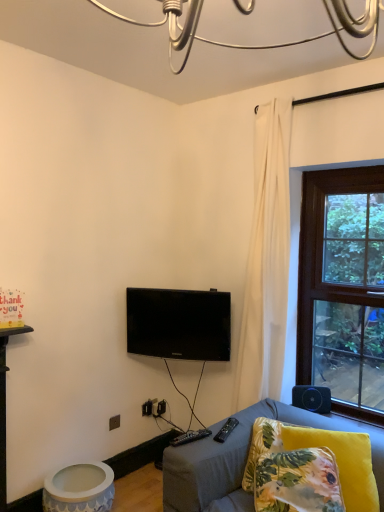
What do you see at coordinates (312, 398) in the screenshot? I see `black fabric speaker at lower right` at bounding box center [312, 398].

Measure the distance between yellow floral pillow at lower right, the first pillow when ordered from left to right, and camera.

yellow floral pillow at lower right, the first pillow when ordered from left to right, and camera are 5.64 feet apart from each other.

Locate an element on the screen. black plastic remote at lower center, the second remote in the left-to-right sequence is located at coordinates (226, 430).

What do you see at coordinates (190, 437) in the screenshot? I see `black plastic remote at lower center, the second remote from the right` at bounding box center [190, 437].

This screenshot has height=512, width=384. What do you see at coordinates (243, 460) in the screenshot? I see `velvet gray couch at lower right` at bounding box center [243, 460].

Identify the location of matte white ceramic table at lower left. The width and height of the screenshot is (384, 512). (79, 488).

Does point (288, 428) appear closer or farther from the camera than point (317, 456)?

Point (288, 428) appears to be farther away from the viewer than point (317, 456).

Could you tell me if yellow floral fabric pillow at lower right, marked as the 2th pillow in a left-to-right arrangement, is facing yellow floral pillow at lower right, the first pillow when ordered from left to right?

Yes, yellow floral fabric pillow at lower right, marked as the 2th pillow in a left-to-right arrangement, is facing yellow floral pillow at lower right, the first pillow when ordered from left to right.

Is yellow floral fabric pillow at lower right, marked as the 2th pillow in a left-to-right arrangement, placed right next to yellow floral pillow at lower right, which appears as the 2th pillow when viewed from the right?

No, yellow floral fabric pillow at lower right, marked as the 2th pillow in a left-to-right arrangement, is not making contact with yellow floral pillow at lower right, which appears as the 2th pillow when viewed from the right.

Considering the sizes of objects yellow floral fabric pillow at lower right, arranged as the first pillow when viewed from the right, and yellow floral pillow at lower right, which appears as the 2th pillow when viewed from the right, in the image provided, who is shorter, yellow floral fabric pillow at lower right, arranged as the first pillow when viewed from the right, or yellow floral pillow at lower right, which appears as the 2th pillow when viewed from the right,?

yellow floral pillow at lower right, which appears as the 2th pillow when viewed from the right.

From the image's perspective, is black plastic remote at lower center, placed as the first remote when sorted from left to right, above or below matte white ceramic table at lower left?

black plastic remote at lower center, placed as the first remote when sorted from left to right, is above matte white ceramic table at lower left.

From the picture: Are black plastic remote at lower center, the second remote from the right, and matte white ceramic table at lower left located far from each other?

black plastic remote at lower center, the second remote from the right, is actually quite close to matte white ceramic table at lower left.

Is matte white ceramic table at lower left located within black plastic remote at lower center, placed as the first remote when sorted from left to right?

Actually, matte white ceramic table at lower left is outside black plastic remote at lower center, placed as the first remote when sorted from left to right.

Do you think yellow floral pillow at lower right, which appears as the 2th pillow when viewed from the right, is within black glossy tv at center, or outside of it?

yellow floral pillow at lower right, which appears as the 2th pillow when viewed from the right, exists outside the volume of black glossy tv at center.

Considering the sizes of objects yellow floral pillow at lower right, which appears as the 2th pillow when viewed from the right, and black glossy tv at center in the image provided, who is shorter, yellow floral pillow at lower right, which appears as the 2th pillow when viewed from the right, or black glossy tv at center?

Standing shorter between the two is yellow floral pillow at lower right, which appears as the 2th pillow when viewed from the right.

Which of these two, yellow floral pillow at lower right, which appears as the 2th pillow when viewed from the right, or black glossy tv at center, is thinner?

With smaller width is black glossy tv at center.

Considering the sizes of objects black fabric speaker at lower right and black glossy tv at center in the image provided, who is shorter, black fabric speaker at lower right or black glossy tv at center?

black fabric speaker at lower right is shorter.

From a real-world perspective, who is located higher, black fabric speaker at lower right or black glossy tv at center?

From a 3D spatial view, black glossy tv at center is above.

The image size is (384, 512). I want to click on loudspeaker behind the black glossy tv at center, so click(312, 398).

Which object is more forward, black glossy tv at center or black plastic remote at lower center, the second remote from the right?

black plastic remote at lower center, the second remote from the right, is more forward.

Locate an element on the screen. The height and width of the screenshot is (512, 384). the 1st remote positioned below the black glossy tv at center (from the image's perspective) is located at coordinates (190, 437).

Could you tell me if black glossy tv at center is facing black plastic remote at lower center, placed as the first remote when sorted from left to right?

Yes, black glossy tv at center is facing black plastic remote at lower center, placed as the first remote when sorted from left to right.

Looking at the image, does black glossy tv at center seem bigger or smaller compared to velvet gray couch at lower right?

Considering their sizes, black glossy tv at center takes up less space than velvet gray couch at lower right.

Considering the sizes of objects black glossy tv at center and velvet gray couch at lower right in the image provided, who is taller, black glossy tv at center or velvet gray couch at lower right?

velvet gray couch at lower right.

Is black glossy tv at center wider than velvet gray couch at lower right?

Incorrect, the width of black glossy tv at center does not surpass that of velvet gray couch at lower right.

Considering the relative positions of black glossy tv at center and velvet gray couch at lower right in the image provided, is black glossy tv at center to the left of velvet gray couch at lower right from the viewer's perspective?

→ Indeed, black glossy tv at center is positioned on the left side of velvet gray couch at lower right.

Does black plastic remote at lower center, the second remote in the left-to-right sequence, have a lesser height compared to black plastic remote at lower center, the second remote from the right?

Indeed, black plastic remote at lower center, the second remote in the left-to-right sequence, has a lesser height compared to black plastic remote at lower center, the second remote from the right.

Which point is more distant from viewer, (215, 438) or (189, 438)?

The point (215, 438) is farther.

From a real-world perspective, between black plastic remote at lower center, the second remote in the left-to-right sequence, and black plastic remote at lower center, the second remote from the right, who is vertically lower?

From a 3D spatial view, black plastic remote at lower center, the second remote in the left-to-right sequence, is below.

Is black plastic remote at lower center, placed as the first remote when sorted from left to right, located within black plastic remote at lower center, the second remote in the left-to-right sequence?

No, black plastic remote at lower center, placed as the first remote when sorted from left to right, is not a part of black plastic remote at lower center, the second remote in the left-to-right sequence.

At what (x,y) coordinates should I click in order to perform the action: click on pillow lying on the right of yellow floral pillow at lower right, the first pillow when ordered from left to right. Please return your answer as a coordinate pair (x, y). Looking at the image, I should click on point(342,462).

Where is `the 2nd remote in front of the matte white ceramic table at lower left, counting from the anchor's position`? The width and height of the screenshot is (384, 512). the 2nd remote in front of the matte white ceramic table at lower left, counting from the anchor's position is located at coordinates (190, 437).

Which object lies further to the anchor point matte white ceramic table at lower left, black plastic remote at lower center, positioned as the first remote in right-to-left order, or black glossy tv at center?

black glossy tv at center is further to matte white ceramic table at lower left.

When comparing their distances from black plastic remote at lower center, the second remote from the right, does black fabric speaker at lower right or yellow floral pillow at lower right, the first pillow when ordered from left to right, seem further?

Based on the image, black fabric speaker at lower right appears to be further to black plastic remote at lower center, the second remote from the right.

Which object lies nearer to the anchor point velvet gray couch at lower right, black glossy tv at center or yellow floral pillow at lower right, the first pillow when ordered from left to right?

yellow floral pillow at lower right, the first pillow when ordered from left to right.

From the picture: Looking at the image, which one is located closer to black plastic remote at lower center, positioned as the first remote in right-to-left order, yellow floral fabric pillow at lower right, arranged as the first pillow when viewed from the right, or black plastic remote at lower center, the second remote from the right?

black plastic remote at lower center, the second remote from the right.

Estimate the real-world distances between objects in this image. Which object is further from black fabric speaker at lower right, black glossy tv at center or black plastic remote at lower center, the second remote from the right?

black plastic remote at lower center, the second remote from the right, is positioned further to the anchor black fabric speaker at lower right.

Estimate the real-world distances between objects in this image. Which object is further from yellow floral pillow at lower right, the first pillow when ordered from left to right, matte white ceramic table at lower left or yellow floral fabric pillow at lower right, arranged as the first pillow when viewed from the right?

matte white ceramic table at lower left.

Based on the photo, considering their positions, is velvet gray couch at lower right positioned closer to yellow floral fabric pillow at lower right, marked as the 2th pillow in a left-to-right arrangement, than black fabric speaker at lower right?

velvet gray couch at lower right is closer to yellow floral fabric pillow at lower right, marked as the 2th pillow in a left-to-right arrangement.

Looking at the image, which one is located closer to matte white ceramic table at lower left, black fabric speaker at lower right or yellow floral fabric pillow at lower right, marked as the 2th pillow in a left-to-right arrangement?

Among the two, yellow floral fabric pillow at lower right, marked as the 2th pillow in a left-to-right arrangement, is located nearer to matte white ceramic table at lower left.

What are the coordinates of `pillow positioned between yellow floral pillow at lower right, the first pillow when ordered from left to right, and black glossy tv at center from near to far` in the screenshot? It's located at (342, 462).

I want to click on pillow between black plastic remote at lower center, placed as the first remote when sorted from left to right, and yellow floral fabric pillow at lower right, arranged as the first pillow when viewed from the right, from left to right, so click(x=298, y=482).

The image size is (384, 512). In order to click on round table between velvet gray couch at lower right and black glossy tv at center in the front-back direction in this screenshot , I will do `click(79, 488)`.

The width and height of the screenshot is (384, 512). Find the location of `pillow located between black plastic remote at lower center, positioned as the first remote in right-to-left order, and yellow floral fabric pillow at lower right, marked as the 2th pillow in a left-to-right arrangement, in the left-right direction`. pillow located between black plastic remote at lower center, positioned as the first remote in right-to-left order, and yellow floral fabric pillow at lower right, marked as the 2th pillow in a left-to-right arrangement, in the left-right direction is located at coordinates (298, 482).